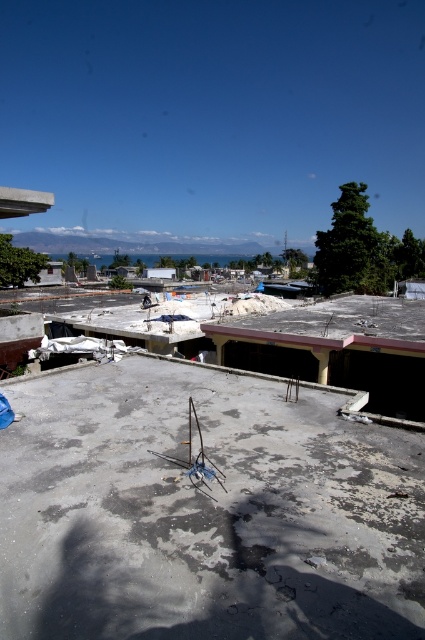
Does gray concrete construction site at center have a greater height compared to concrete roof at center?

No, gray concrete construction site at center is not taller than concrete roof at center.

Is gray concrete construction site at center bigger than concrete roof at center?

Incorrect, gray concrete construction site at center is not larger than concrete roof at center.

Identify the location of gray concrete construction site at center. (204, 509).

The image size is (425, 640). In order to click on gray concrete construction site at center in this screenshot , I will do `click(204, 509)`.